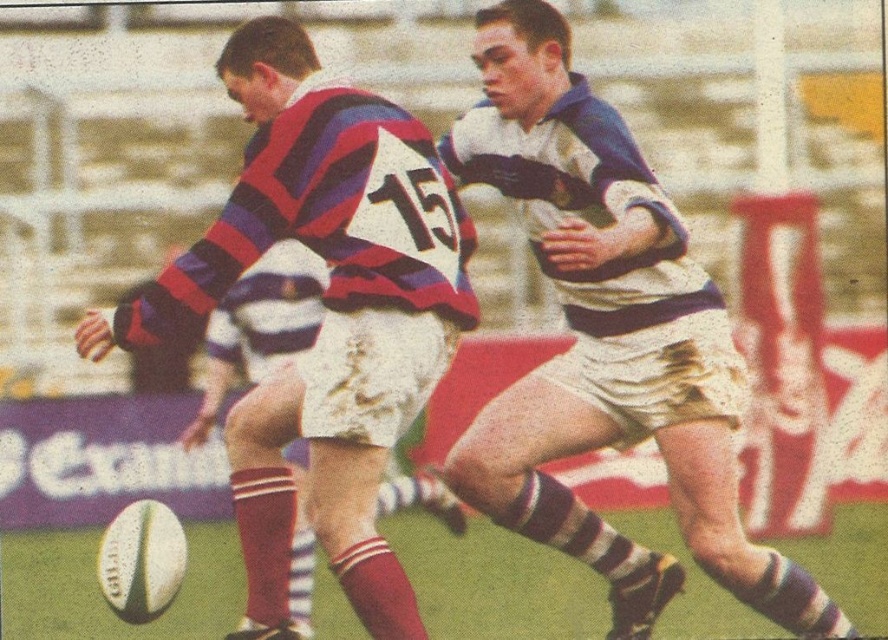
You are a referee watching the rugby match. You need to determine if the player at point A is behind the player at point B. Player A is at point (585,189) and Player B is at point (422,157). Based on the image, is Player A behind Player B?

Point (585,189) is behind point (422,157), so yes, Player A is behind Player B.

You are a sports analyst watching the rugby match. You notice two key items at center field. Which item is positioned lower between the white textured shorts at center and the striped jersey at center?

The white textured shorts at center is positioned lower than the striped jersey at center.